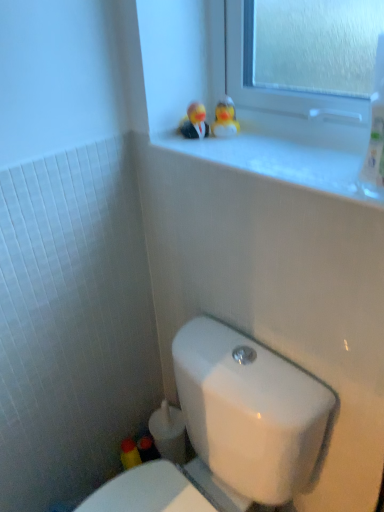
The width and height of the screenshot is (384, 512). What are the coordinates of `vacant space to the right of rubber duck at upper center, the second miniature from the right` in the screenshot? It's located at (262, 139).